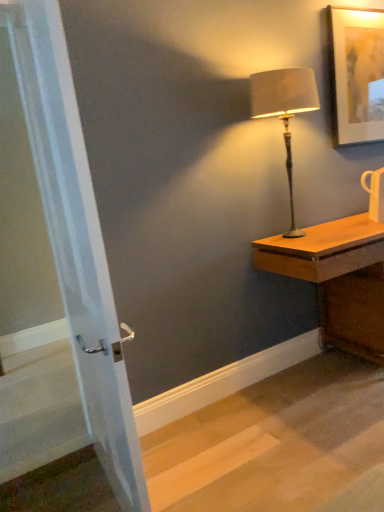
Question: From a real-world perspective, is white glossy mug at upper right physically located above or below wooden desk at right?

Choices:
 (A) above
 (B) below

Answer: (A)

Question: From the image's perspective, is white glossy mug at upper right positioned above or below wooden desk at right?

Choices:
 (A) below
 (B) above

Answer: (B)

Question: Which is nearer to the white glossy screen door at left?

Choices:
 (A) matte white picture frame at upper right
 (B) wooden desk at right
 (C) satin beige lampshade at right
 (D) white glossy mug at upper right

Answer: (C)

Question: Estimate the real-world distances between objects in this image. Which object is closer to the wooden desk at right?

Choices:
 (A) matte white picture frame at upper right
 (B) white glossy screen door at left
 (C) satin beige lampshade at right
 (D) white glossy mug at upper right

Answer: (D)